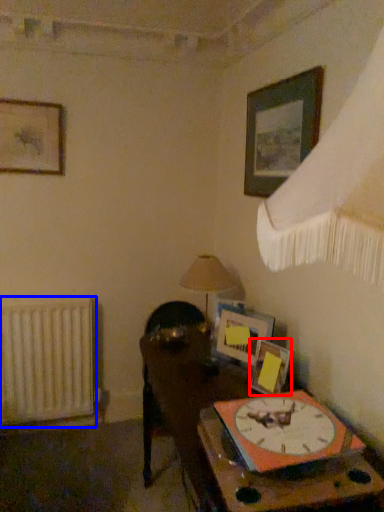
Question: Which of the following is the farthest to the observer, picture frame (highlighted by a red box) or radiator (highlighted by a blue box)?

Choices:
 (A) picture frame
 (B) radiator

Answer: (B)